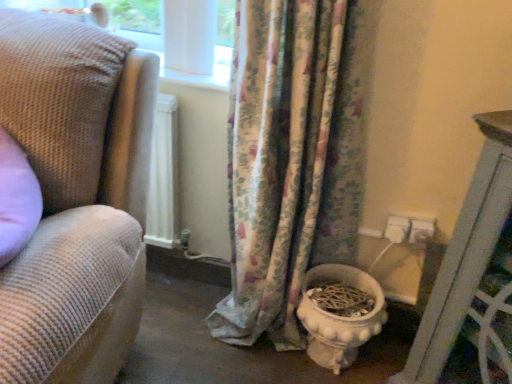
This screenshot has width=512, height=384. Describe the element at coordinates (294, 158) in the screenshot. I see `floral fabric curtain at center` at that location.

Locate an element on the screen. This screenshot has height=384, width=512. floral fabric curtain at center is located at coordinates (294, 158).

Consider the image. Is white glossy toilet bowl at lower center directly adjacent to floral fabric curtain at center?

No, white glossy toilet bowl at lower center is not next to floral fabric curtain at center.

Considering the sizes of objects white glossy toilet bowl at lower center and floral fabric curtain at center in the image provided, who is shorter, white glossy toilet bowl at lower center or floral fabric curtain at center?

With less height is white glossy toilet bowl at lower center.

Locate an element on the screen. toilet bowl behind the floral fabric curtain at center is located at coordinates (339, 318).

Is floral fabric curtain at center at the back of white glossy toilet bowl at lower center?

Yes, white glossy toilet bowl at lower center is facing away from floral fabric curtain at center.

Based on their sizes in the image, would you say woven fabric couch at left is bigger or smaller than floral fabric curtain at center?

woven fabric couch at left is bigger than floral fabric curtain at center.

Do you think woven fabric couch at left is within floral fabric curtain at center, or outside of it?

woven fabric couch at left is located beyond the bounds of floral fabric curtain at center.

Based on the photo, in terms of height, does woven fabric couch at left look taller or shorter compared to floral fabric curtain at center?

woven fabric couch at left is shorter than floral fabric curtain at center.

Is there a large distance between floral fabric curtain at center and white glossy toilet bowl at lower center?

No, floral fabric curtain at center is in close proximity to white glossy toilet bowl at lower center.

Which is in front, point (347, 47) or point (322, 362)?

The point (347, 47) is more forward.

Considering the sizes of objects floral fabric curtain at center and white glossy toilet bowl at lower center in the image provided, who is bigger, floral fabric curtain at center or white glossy toilet bowl at lower center?

floral fabric curtain at center.

You are a GUI agent. You are given a task and a screenshot of the screen. Output one action in this format:
    pyautogui.click(x=<x>, y=<y>)
    Task: Click on the curtain above the white glossy toilet bowl at lower center (from a real-world perspective)
    This screenshot has height=384, width=512.
    Given the screenshot: What is the action you would take?
    pyautogui.click(x=294, y=158)

Can you confirm if floral fabric curtain at center is wider than woven fabric couch at left?

Incorrect, the width of floral fabric curtain at center does not surpass that of woven fabric couch at left.

From the image's perspective, between floral fabric curtain at center and woven fabric couch at left, which one is located above?

floral fabric curtain at center is shown above in the image.

Which is in front, point (270, 337) or point (10, 46)?

The point (10, 46) is closer.

From the image's perspective, who appears lower, white glossy toilet bowl at lower center or woven fabric couch at left?

From the image's view, white glossy toilet bowl at lower center is below.

Which is closer, [367,320] or [83,205]?

Point [367,320] is positioned farther from the camera compared to point [83,205].

From a real-world perspective, relative to woven fabric couch at left, is white glossy toilet bowl at lower center vertically above or below?

In terms of real-world spatial position, white glossy toilet bowl at lower center is below woven fabric couch at left.

Visually, is white glossy toilet bowl at lower center positioned to the left or to the right of woven fabric couch at left?

From the image, it's evident that white glossy toilet bowl at lower center is to the right of woven fabric couch at left.

Considering the relative sizes of woven fabric couch at left and white glossy toilet bowl at lower center in the image provided, is woven fabric couch at left shorter than white glossy toilet bowl at lower center?

Incorrect, the height of woven fabric couch at left does not fall short of that of white glossy toilet bowl at lower center.

In the image, there is a woven fabric couch at left. Where is `toilet bowl below it (from a real-world perspective)`? The image size is (512, 384). toilet bowl below it (from a real-world perspective) is located at coordinates (339, 318).

Is woven fabric couch at left to the right of white glossy toilet bowl at lower center from the viewer's perspective?

In fact, woven fabric couch at left is to the left of white glossy toilet bowl at lower center.

Which is behind, woven fabric couch at left or white glossy toilet bowl at lower center?

white glossy toilet bowl at lower center.

This screenshot has height=384, width=512. In the image, there is a floral fabric curtain at center. Find the location of `toilet bowl below it (from a real-world perspective)`. toilet bowl below it (from a real-world perspective) is located at coordinates (339, 318).

Image resolution: width=512 pixels, height=384 pixels. I want to click on curtain that is above the woven fabric couch at left (from a real-world perspective), so click(294, 158).

Based on the photo, based on their spatial positions, is white glossy toilet bowl at lower center or woven fabric couch at left closer to floral fabric curtain at center?

white glossy toilet bowl at lower center is positioned closer to the anchor floral fabric curtain at center.

Looking at the image, which one is located further to woven fabric couch at left, floral fabric curtain at center or white glossy toilet bowl at lower center?

Among the two, white glossy toilet bowl at lower center is located further to woven fabric couch at left.

Based on their spatial positions, is woven fabric couch at left or white glossy toilet bowl at lower center closer to floral fabric curtain at center?

The object closer to floral fabric curtain at center is white glossy toilet bowl at lower center.

Estimate the real-world distances between objects in this image. Which object is further from woven fabric couch at left, white glossy toilet bowl at lower center or floral fabric curtain at center?

The object further to woven fabric couch at left is white glossy toilet bowl at lower center.

Looking at the image, which one is located closer to white glossy toilet bowl at lower center, woven fabric couch at left or floral fabric curtain at center?

floral fabric curtain at center lies closer to white glossy toilet bowl at lower center than the other object.

Based on their spatial positions, is floral fabric curtain at center or woven fabric couch at left closer to white glossy toilet bowl at lower center?

floral fabric curtain at center is positioned closer to the anchor white glossy toilet bowl at lower center.

Identify the location of curtain between woven fabric couch at left and white glossy toilet bowl at lower center in the horizontal direction. (294, 158).